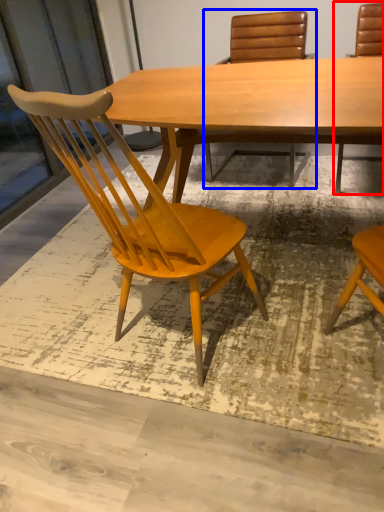
Question: Which point is further to the camera, chair (highlighted by a red box) or chair (highlighted by a blue box)?

Choices:
 (A) chair
 (B) chair

Answer: (B)